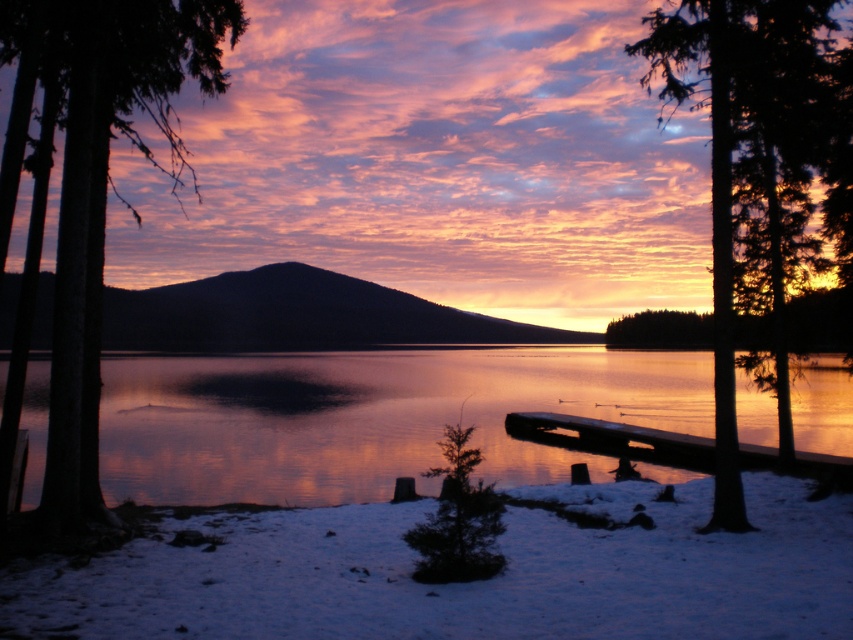
Is green matte tree at upper right positioned in front of wooden dock at lower right?

That is True.

Is point (726, 125) less distant than point (773, 449)?

Yes, it is in front of point (773, 449).

This screenshot has width=853, height=640. I want to click on green matte tree at upper right, so click(x=751, y=168).

This screenshot has height=640, width=853. I want to click on green matte tree at upper right, so click(751, 168).

Measure the distance from green matte tree at upper right to smooth bark tree at left.

green matte tree at upper right is 14.11 meters from smooth bark tree at left.

What do you see at coordinates (751, 168) in the screenshot? I see `green matte tree at upper right` at bounding box center [751, 168].

Locate an element on the screen. This screenshot has width=853, height=640. green matte tree at upper right is located at coordinates (751, 168).

Which is above, smooth bark tree at left or wooden dock at lower right?

smooth bark tree at left is higher up.

The width and height of the screenshot is (853, 640). I want to click on smooth bark tree at left, so click(105, 189).

Where is `smooth bark tree at left`? smooth bark tree at left is located at coordinates (105, 189).